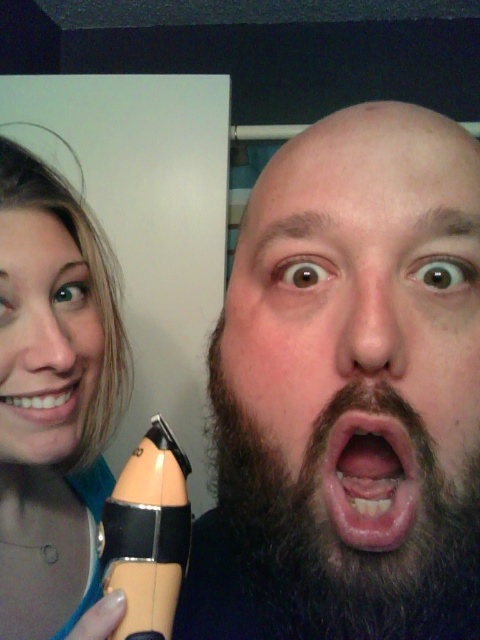
Is dark brown beard at center taller than white glossy teeth at center?

Yes.

Can you confirm if dark brown beard at center is wider than white glossy teeth at center?

Indeed, dark brown beard at center has a greater width compared to white glossy teeth at center.

The image size is (480, 640). Describe the element at coordinates (356, 358) in the screenshot. I see `dark brown beard at center` at that location.

This screenshot has width=480, height=640. I want to click on dark brown beard at center, so click(356, 358).

Does pink flesh at center have a smaller size compared to white glossy teeth at center?

Indeed, pink flesh at center has a smaller size compared to white glossy teeth at center.

Is pink flesh at center taller than white glossy teeth at center?

Yes.

You are a GUI agent. You are given a task and a screenshot of the screen. Output one action in this format:
    pyautogui.click(x=<x>, y=<y>)
    Task: Click on the pink flesh at center
    The height and width of the screenshot is (640, 480).
    Given the screenshot: What is the action you would take?
    pyautogui.click(x=368, y=476)

Which is behind, point (6, 417) or point (59, 401)?

The point (59, 401) is more distant.

Between matte skin face at left and white glossy teeth at center, which one has less height?

white glossy teeth at center

Locate an element on the screen. matte skin face at left is located at coordinates pos(44,339).

Locate an element on the screen. The width and height of the screenshot is (480, 640). matte skin face at left is located at coordinates (44, 339).